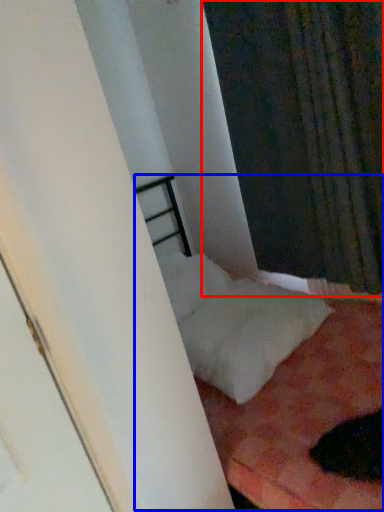
Question: Which object appears closest to the camera in this image, curtain (highlighted by a red box) or bed (highlighted by a blue box)?

Choices:
 (A) curtain
 (B) bed

Answer: (B)